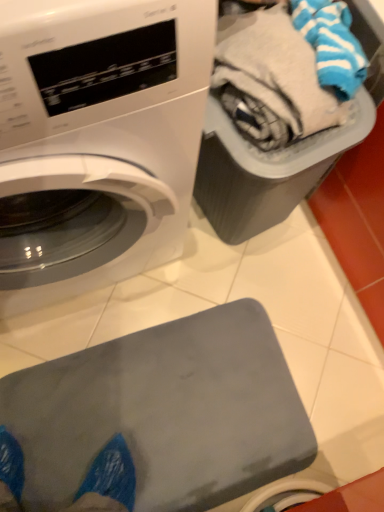
At what (x,y) coordinates should I click in order to perform the action: click on free spot below gray rubber mat at lower center (from a real-world perspective). Please return your answer as a coordinate pair (x, y). Looking at the image, I should click on (155, 420).